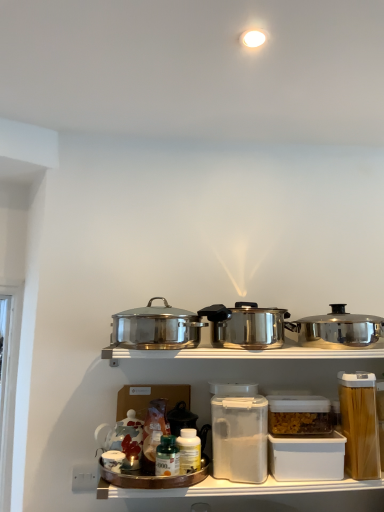
Find the location of a particular element. vacant area that lies between white plastic container at lower center and green glass bottle at center, the first bottle from the left is located at coordinates (235, 482).